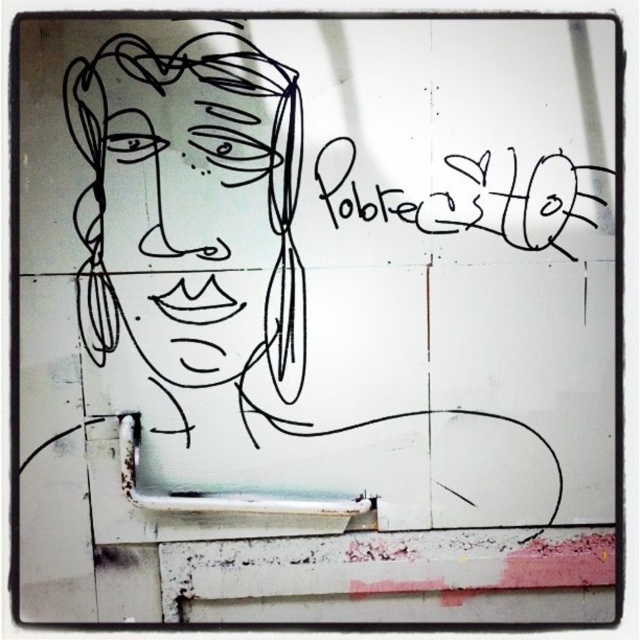
Question: Can you confirm if black line drawing face at upper left is positioned below black marker writing at upper right?

Choices:
 (A) yes
 (B) no

Answer: (A)

Question: Is black line drawing face at upper left further to camera compared to black marker writing at upper right?

Choices:
 (A) no
 (B) yes

Answer: (A)

Question: Which of the following is the closest to the observer?

Choices:
 (A) (452, 221)
 (B) (244, 243)

Answer: (B)

Question: Among these points, which one is farthest from the camera?

Choices:
 (A) (449, 230)
 (B) (218, 257)

Answer: (A)

Question: Can you confirm if black line drawing face at upper left is positioned above black marker writing at upper right?

Choices:
 (A) yes
 (B) no

Answer: (B)

Question: Which point is farther to the camera?

Choices:
 (A) (150, 288)
 (B) (564, 164)

Answer: (B)